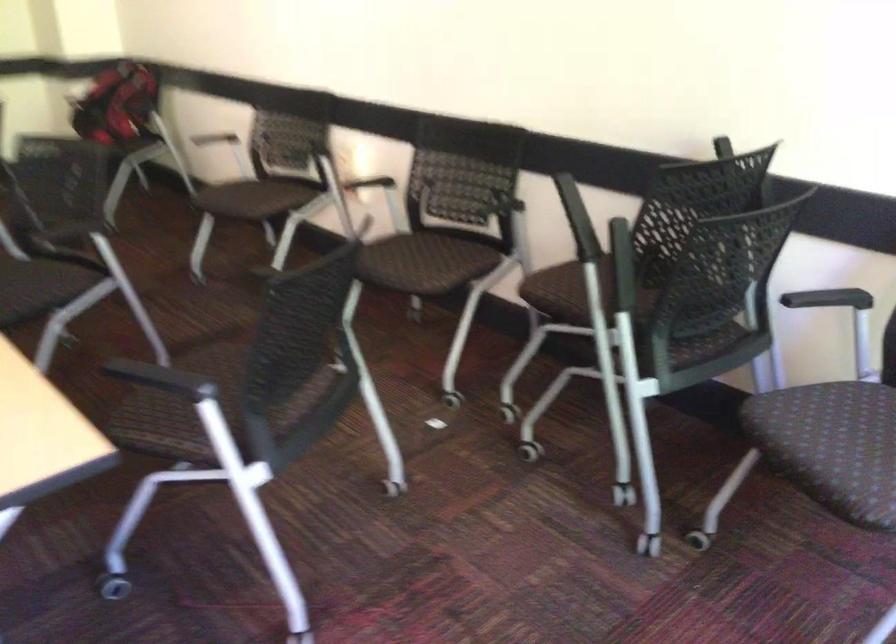
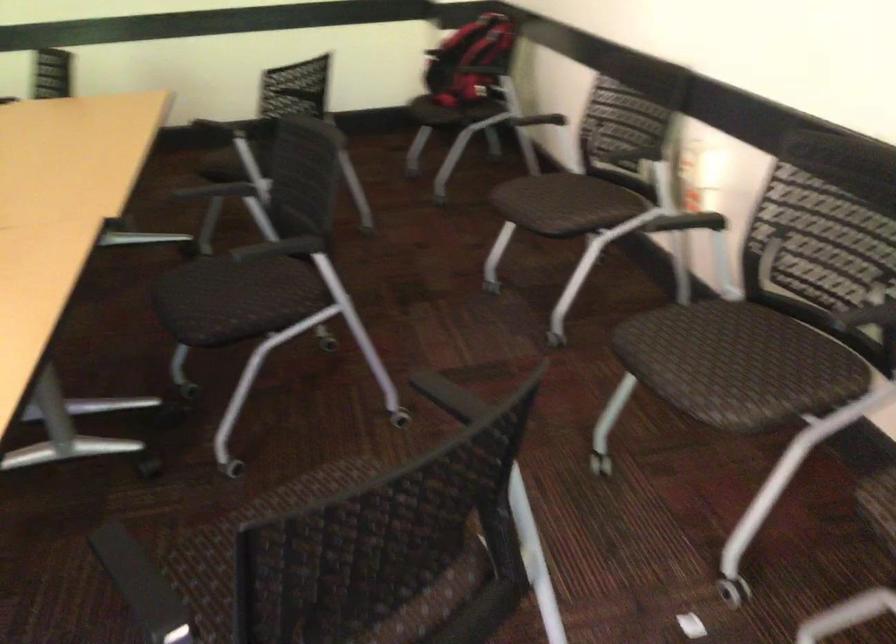
In the second image, find the point that corresponds to (127,98) in the first image.

(471, 61)